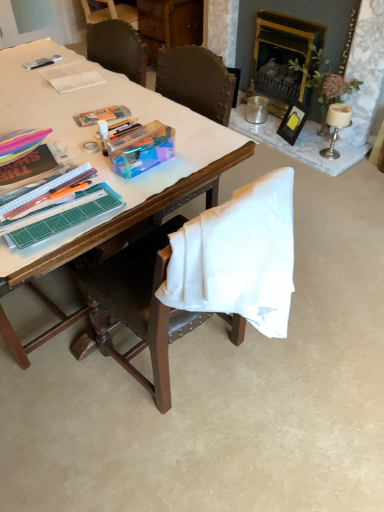
What is the approximate height of wooden chair at center?

wooden chair at center is 91.29 centimeters tall.

Measure the distance between wooden desk at center and camera.

wooden desk at center and camera are 1.06 meters apart.

Locate an element on the screen. wooden desk at center is located at coordinates (104, 167).

The width and height of the screenshot is (384, 512). In order to click on metallic silver pen at upper left in this screenshot , I will do `click(42, 62)`.

The width and height of the screenshot is (384, 512). I want to click on gold-framed fireplace at upper right, so click(x=283, y=58).

Where is `picture frame that is behind the wooden desk at center`? The width and height of the screenshot is (384, 512). picture frame that is behind the wooden desk at center is located at coordinates (293, 122).

Which of these two, black wood picture frame at upper right or wooden desk at center, stands shorter?

With less height is black wood picture frame at upper right.

From the picture: Between black wood picture frame at upper right and wooden desk at center, which one has smaller size?

black wood picture frame at upper right is smaller.

Are black wood picture frame at upper right and wooden desk at center far apart?

Yes, black wood picture frame at upper right and wooden desk at center are located far from each other.

Find the location of a particular element. paperback book that appears on the left of black wood picture frame at upper right is located at coordinates coord(72,76).

Is black wood picture frame at upper right facing away from white paper at upper left?

No.

Is black wood picture frame at upper right spatially inside white paper at upper left, or outside of it?

black wood picture frame at upper right exists outside the volume of white paper at upper left.

From a real-world perspective, is black wood picture frame at upper right physically below white paper at upper left?

Yes, from a real-world perspective, black wood picture frame at upper right is under white paper at upper left.

Which object is positioned more to the right, white paper at upper left or metallic silver pen at upper left?

white paper at upper left is more to the right.

From a real-world perspective, relative to metallic silver pen at upper left, is white paper at upper left vertically above or below?

Clearly, from a real-world perspective, white paper at upper left is above metallic silver pen at upper left.

Which of these two, white paper at upper left or metallic silver pen at upper left, is smaller?

metallic silver pen at upper left.

From the image's perspective, which one is positioned lower, white paper at upper left or metallic silver pen at upper left?

white paper at upper left appears lower in the image.

Is wooden chair at center shorter than white paper at upper left?

Incorrect, the height of wooden chair at center does not fall short of that of white paper at upper left.

Could you tell me if wooden chair at center is turned towards white paper at upper left?

Yes, wooden chair at center is facing white paper at upper left.

The image size is (384, 512). Identify the location of paperback book above the wooden chair at center (from a real-world perspective). (72, 76).

Is wooden chair at center at the right side of white paper at upper left?

Correct, you'll find wooden chair at center to the right of white paper at upper left.

Does black wood picture frame at upper right have a greater height compared to gold-framed fireplace at upper right?

No, black wood picture frame at upper right is not taller than gold-framed fireplace at upper right.

Measure the distance between black wood picture frame at upper right and gold-framed fireplace at upper right.

The distance of black wood picture frame at upper right from gold-framed fireplace at upper right is 31.40 centimeters.

Is point (281, 129) positioned in front of point (289, 84)?

Yes, it is in front of point (289, 84).

Which is behind, point (50, 336) or point (43, 60)?

The point (43, 60) is more distant.

From the image's perspective, between wooden desk at center and metallic silver pen at upper left, who is located below?

wooden desk at center, from the image's perspective.

Is metallic silver pen at upper left at the back of wooden desk at center?

That's not correct — wooden desk at center is not looking away from metallic silver pen at upper left.

From the picture: Does wooden desk at center appear on the right side of black wood picture frame at upper right?

No.

Considering the points (235, 144) and (284, 135), which point is behind, point (235, 144) or point (284, 135)?

Point (284, 135)

From the image's perspective, would you say wooden desk at center is positioned over black wood picture frame at upper right?

No, from the image's perspective, wooden desk at center is not over black wood picture frame at upper right.

Identify the location of picture frame beneath the wooden desk at center (from a real-world perspective). (293, 122).

This screenshot has height=512, width=384. Identify the location of paperback book that is above the black wood picture frame at upper right (from a real-world perspective). pyautogui.click(x=72, y=76).

When comparing their distances from black wood picture frame at upper right, does gold-framed fireplace at upper right or wooden desk at center seem closer?

gold-framed fireplace at upper right is closer to black wood picture frame at upper right.

Considering their positions, is black wood picture frame at upper right positioned closer to white paper at upper left than wooden chair at center?

Among the two, wooden chair at center is located nearer to white paper at upper left.

Which object lies further to the anchor point wooden chair at center, wooden desk at center or white paper at upper left?

white paper at upper left.

Which object lies further to the anchor point wooden chair at center, white paper at upper left or wooden desk at center?

The object further to wooden chair at center is white paper at upper left.

Considering their positions, is gold-framed fireplace at upper right positioned further to wooden chair at center than wooden desk at center?

gold-framed fireplace at upper right lies further to wooden chair at center than the other object.

From the image, which object appears to be farther from wooden desk at center, metallic silver pen at upper left or wooden chair at center?

Based on the image, metallic silver pen at upper left appears to be further to wooden desk at center.

In the scene shown: Estimate the real-world distances between objects in this image. Which object is closer to wooden chair at center, black wood picture frame at upper right or metallic silver pen at upper left?

metallic silver pen at upper left is positioned closer to the anchor wooden chair at center.

When comparing their distances from wooden desk at center, does wooden chair at center or black wood picture frame at upper right seem further?

black wood picture frame at upper right lies further to wooden desk at center than the other object.

This screenshot has width=384, height=512. In order to click on pen positioned between wooden desk at center and black wood picture frame at upper right from near to far in this screenshot , I will do `click(42, 62)`.

Locate an element on the screen. The width and height of the screenshot is (384, 512). desk located between wooden chair at center and metallic silver pen at upper left in the depth direction is located at coordinates (104, 167).

Image resolution: width=384 pixels, height=512 pixels. I want to click on paperback book located between metallic silver pen at upper left and black wood picture frame at upper right in the left-right direction, so click(x=72, y=76).

This screenshot has width=384, height=512. In order to click on paperback book located between wooden desk at center and black wood picture frame at upper right in the depth direction in this screenshot , I will do `click(72, 76)`.